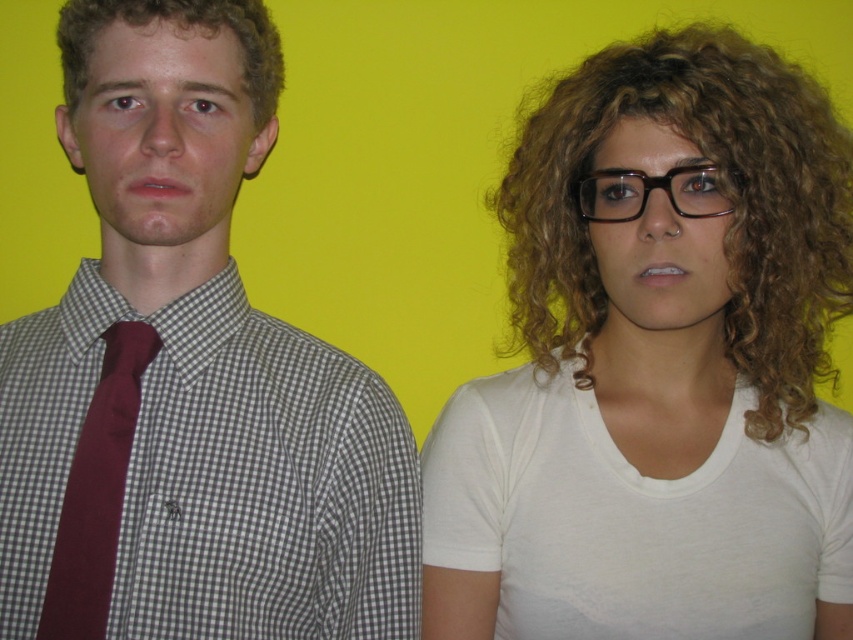
Question: Among these objects, which one is farthest from the camera?

Choices:
 (A) maroon fabric tie at left
 (B) curly blonde hair at right
 (C) checkered fabric shirt with tie at left

Answer: (B)

Question: Among these objects, which one is farthest from the camera?

Choices:
 (A) checkered fabric shirt with tie at left
 (B) curly blonde hair at right
 (C) black plastic glasses at center

Answer: (C)

Question: Which point is farther to the camera?

Choices:
 (A) (769, 124)
 (B) (97, 112)
 (C) (73, 8)
 (D) (680, 204)

Answer: (C)

Question: Is curly blonde hair at right behind maroon fabric tie at left?

Choices:
 (A) no
 (B) yes

Answer: (B)

Question: Does maroon fabric tie at left have a greater width compared to curly blonde hair at left?

Choices:
 (A) yes
 (B) no

Answer: (B)

Question: Does curly blonde hair at right appear on the right side of black plastic glasses at center?

Choices:
 (A) no
 (B) yes

Answer: (B)